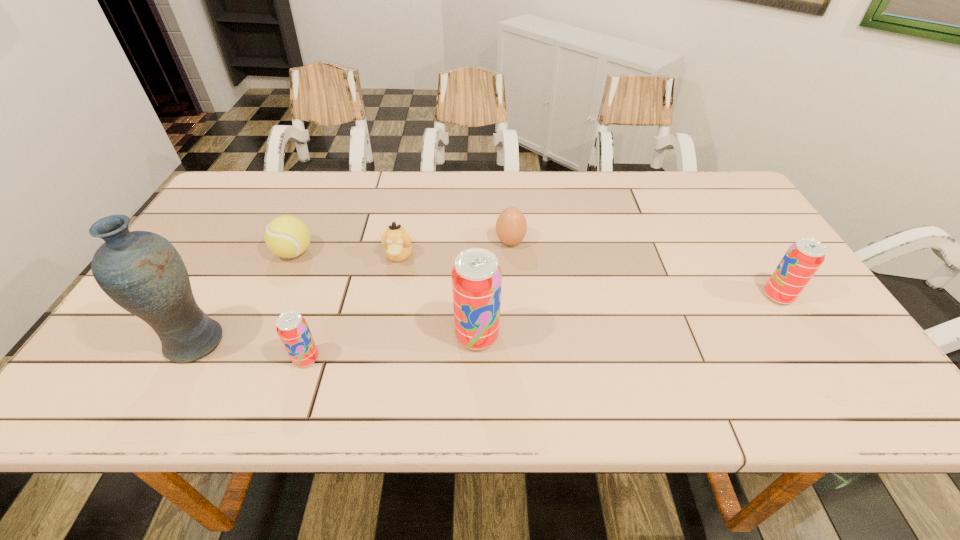
This screenshot has height=540, width=960. I want to click on the tallest object, so click(141, 271).

I want to click on free region located on the back of the third object from left to right, so click(341, 254).

In order to click on free region located 0.220m on the left of the second soda can from right to left in this screenshot , I will do `click(358, 336)`.

You are a GUI agent. You are given a task and a screenshot of the screen. Output one action in this format:
    pyautogui.click(x=<x>, y=<y>)
    Task: Click on the free spot located 0.120m on the left of the farthest soda can
    The image size is (960, 540).
    Given the screenshot: What is the action you would take?
    pyautogui.click(x=714, y=296)

Find the location of a particular element. free space located on the back of the tennis ball is located at coordinates (330, 172).

You are a GUI agent. You are given a task and a screenshot of the screen. Output one action in this format:
    pyautogui.click(x=<x>, y=<y>)
    Task: Click on the vacant space located on the face of the fourth object from left to right
    
    Given the screenshot: What is the action you would take?
    pyautogui.click(x=382, y=345)

Where is `vacant space located 0.230m on the right of the boiled egg`? The image size is (960, 540). vacant space located 0.230m on the right of the boiled egg is located at coordinates (609, 242).

Where is `vacant space located 0.260m on the back of the leftmost object`? The height and width of the screenshot is (540, 960). vacant space located 0.260m on the back of the leftmost object is located at coordinates (249, 247).

The width and height of the screenshot is (960, 540). Find the location of `vase that is at the near edge`. vase that is at the near edge is located at coordinates (141, 271).

This screenshot has width=960, height=540. Identify the location of object that is at the left edge. click(x=141, y=271).